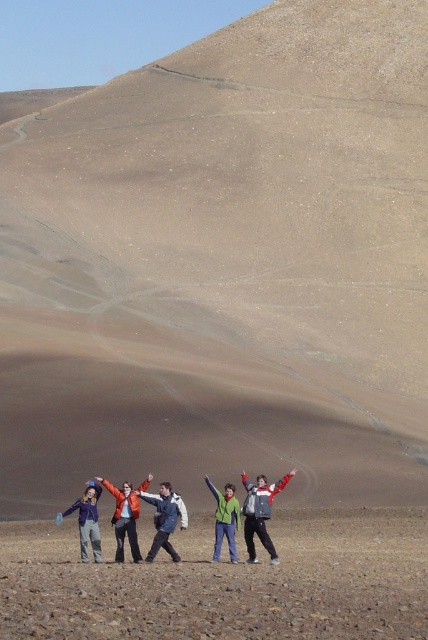
You are a photographer standing at the center of the image. You want to take a photo of the matte blue jacket at lower left. Which direction should you move to get the best shot?

The matte blue jacket at lower left is located at point 0.814 on the x axis and 0.203 on the y axis. Since you are at the center of the image, you should move to the left and down to align with the jacket.

You are standing at the bottom of the rocky terrain looking towards the hills. There are two points marked on the ground in front of you. The first point is at coordinate point (70,508) and the second is at point (116,486). Which point is closer to you?

Point (70,508) is in front of point (116,486), so it is closer to you.

You are standing on the brown sandy ground at lower center and want to throw a small stone to the orange jacket at center. Can you reach it with a single throw if your maximum throwing distance is 4 meters?

The distance between the brown sandy ground at lower center and the orange jacket at center is 4.54 meters, which exceeds your maximum throwing distance of 4 meters. Therefore, you cannot reach the orange jacket at center with a single throw.